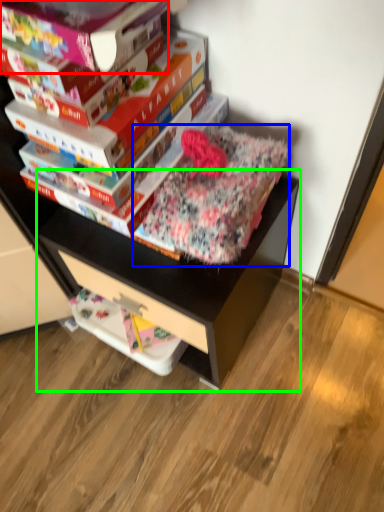
Question: Based on their relative distances, which object is nearer to paperback book (highlighted by a red box)? Choose from bedding (highlighted by a blue box) and computer desk (highlighted by a green box).

Choices:
 (A) bedding
 (B) computer desk

Answer: (A)